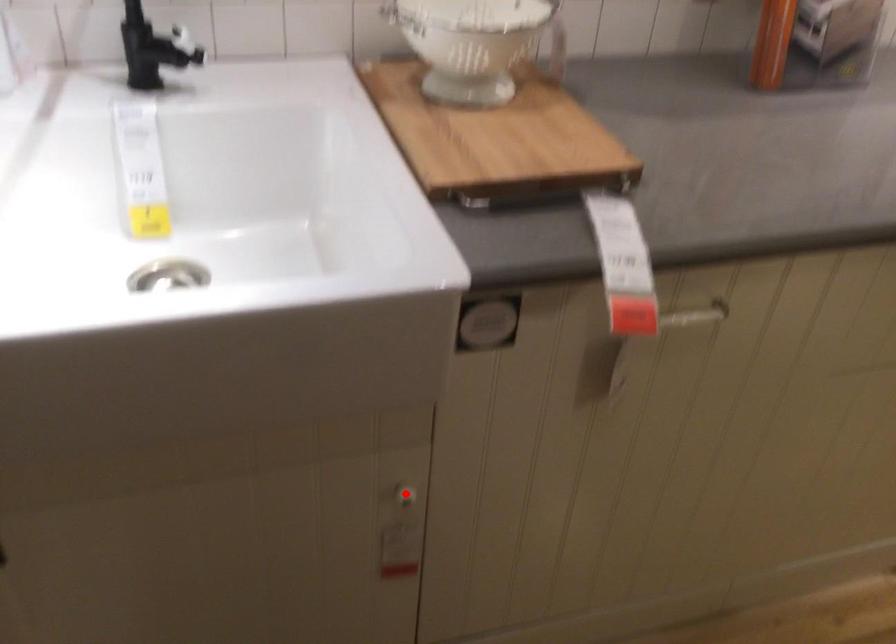
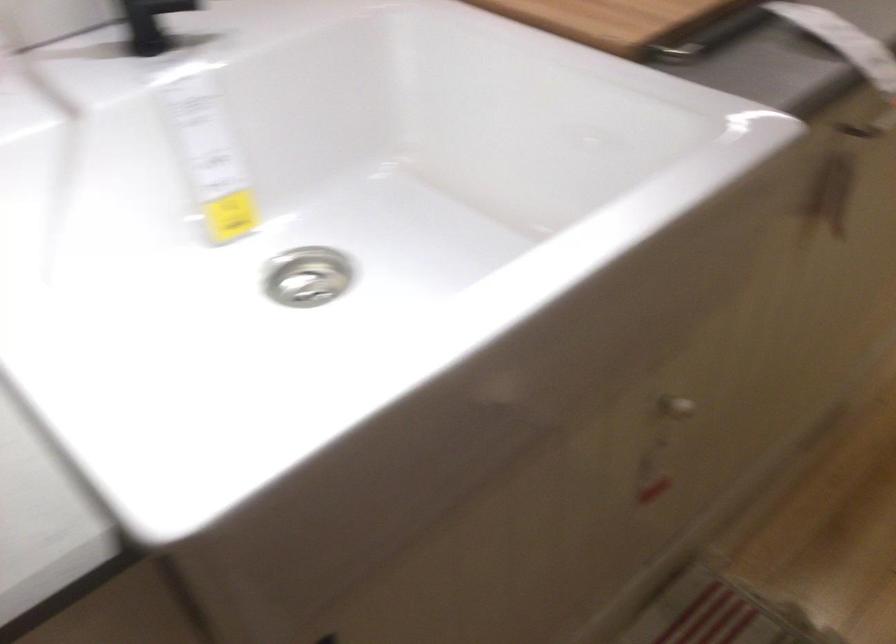
In the second image, find the point that corresponds to the highlighted location in the first image.

(675, 408)